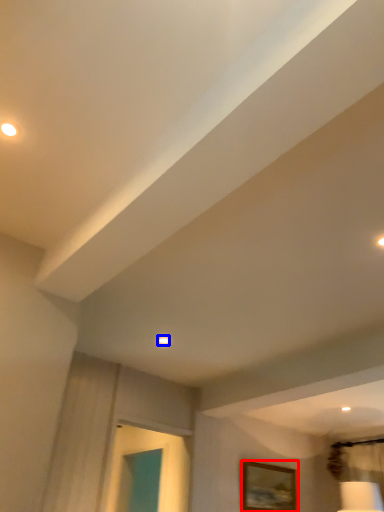
Question: Which object appears farthest to the camera in this image, picture frame (highlighted by a red box) or droplight (highlighted by a blue box)?

Choices:
 (A) picture frame
 (B) droplight

Answer: (A)